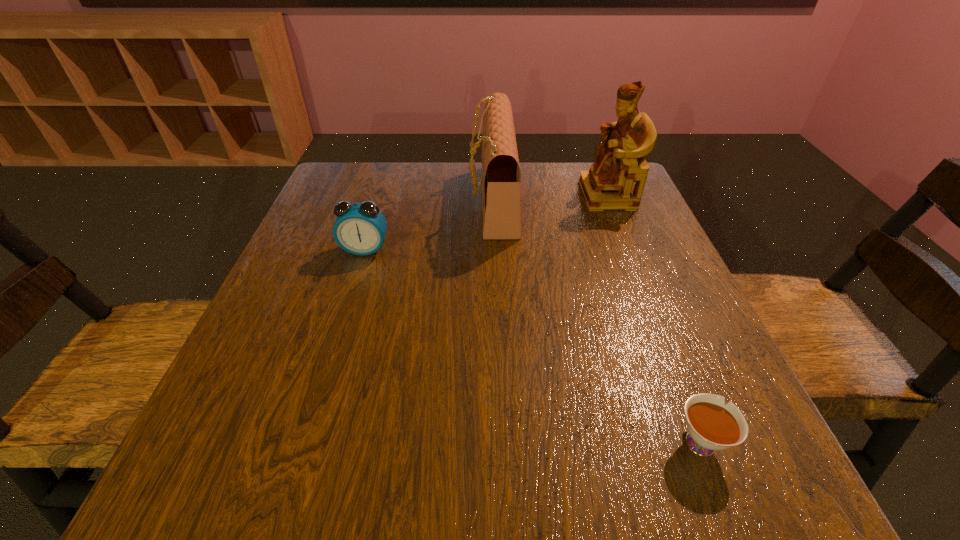
Locate an element on the screen. Image resolution: width=960 pixels, height=540 pixels. free space at the far right corner of the desktop is located at coordinates (571, 169).

The image size is (960, 540). I want to click on vacant space at the near right corner of the desktop, so click(678, 453).

The height and width of the screenshot is (540, 960). I want to click on empty space that is in between the nearest object and the second nearest object, so click(532, 345).

Find the location of a particular element. free area in between the figurine and the third shortest object is located at coordinates (550, 198).

I want to click on free space between the third farthest object and the handbag, so click(x=429, y=225).

Identify the location of free space between the tallest object and the handbag. (550, 198).

You are a GUI agent. You are given a task and a screenshot of the screen. Output one action in this format:
    pyautogui.click(x=<x>, y=<y>)
    Task: Click on the vacant point located between the figurine and the third object from right to left
    This screenshot has height=540, width=960.
    Given the screenshot: What is the action you would take?
    pyautogui.click(x=550, y=198)

You are a GUI agent. You are given a task and a screenshot of the screen. Output one action in this format:
    pyautogui.click(x=<x>, y=<y>)
    Task: Click on the empty space that is in between the leftmost object and the shortest object
    Image resolution: width=960 pixels, height=540 pixels.
    Given the screenshot: What is the action you would take?
    pyautogui.click(x=532, y=345)

What are the coordinates of `vacant space in between the third tallest object and the shortest object` in the screenshot? It's located at (532, 345).

Find the location of a particular element. The image size is (960, 540). empty space that is in between the nearest object and the third tallest object is located at coordinates (532, 345).